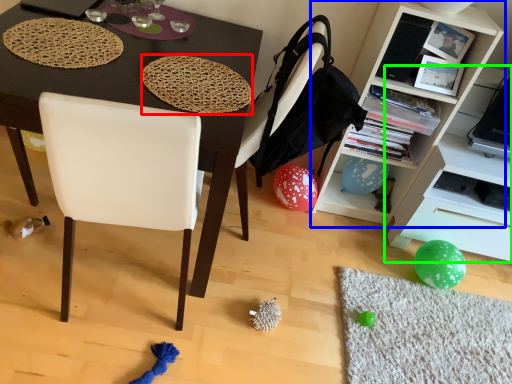
Question: Considering the real-world distances, which object is farthest from mat (highlighted by a red box)? cabinetry (highlighted by a blue box) or shelf (highlighted by a green box)?

Choices:
 (A) cabinetry
 (B) shelf

Answer: (B)